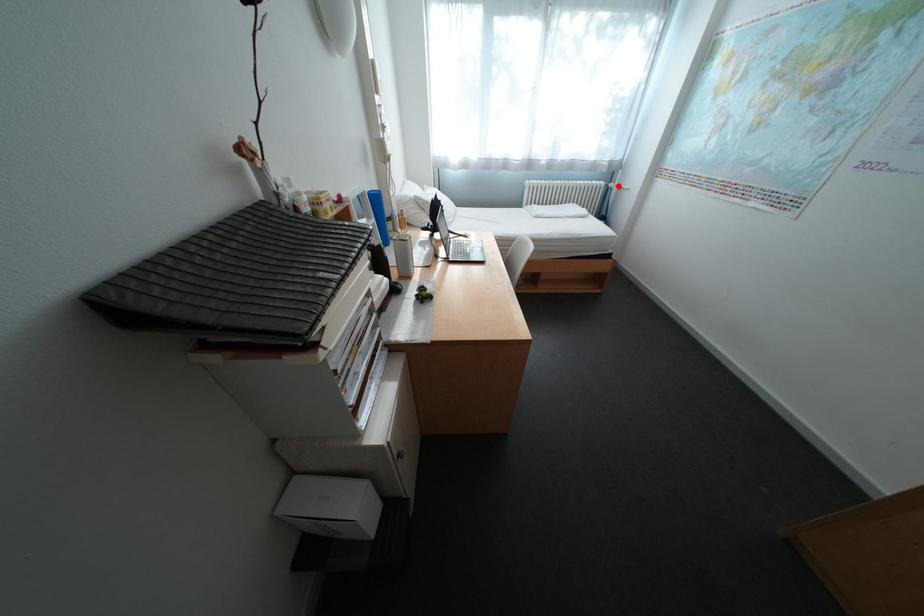
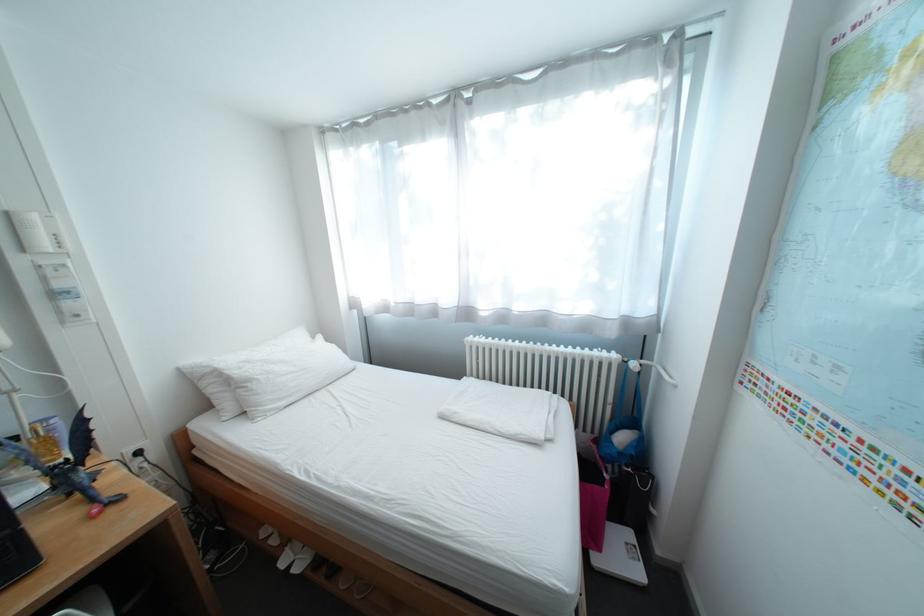
Find the pixel in the second image that matches the highlighted location in the first image.

(637, 362)